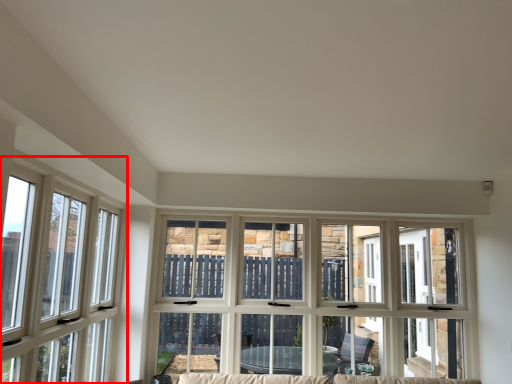
Question: From the image's perspective, where is window (annotated by the red box) located in relation to window in the image?

Choices:
 (A) below
 (B) above

Answer: (B)